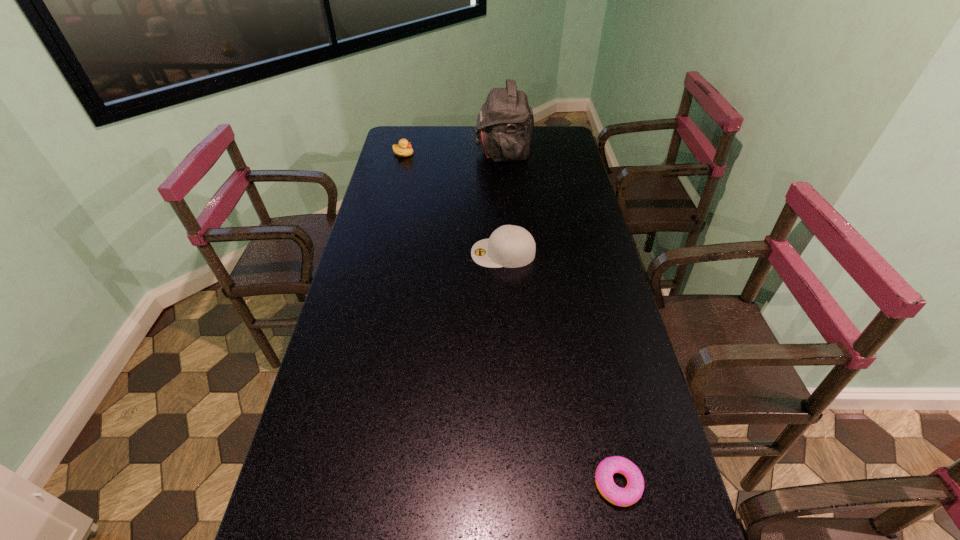
I want to click on blank space at the left edge, so click(393, 209).

Find the location of a particular element. The image size is (960, 540). blank space at the right edge of the desktop is located at coordinates (596, 220).

Identify the location of free space at the far left corner. (423, 128).

Image resolution: width=960 pixels, height=540 pixels. Find the location of `vacant space at the far right corner of the desktop`. vacant space at the far right corner of the desktop is located at coordinates (561, 132).

Where is `vacant space in between the third tallest object and the cap`? vacant space in between the third tallest object and the cap is located at coordinates [x=453, y=203].

Where is `empty space that is in between the tallest object and the doughnut`? This screenshot has height=540, width=960. empty space that is in between the tallest object and the doughnut is located at coordinates (561, 318).

The image size is (960, 540). In order to click on vacant space that's between the shoulder bag and the duckling in this screenshot , I will do `click(453, 152)`.

Identify the location of free area in between the third farthest object and the shortest object. (561, 368).

Where is `empty space between the shoulder bag and the third shortest object`? empty space between the shoulder bag and the third shortest object is located at coordinates (503, 202).

Find the location of a particular element. free space between the cap and the tallest object is located at coordinates (503, 202).